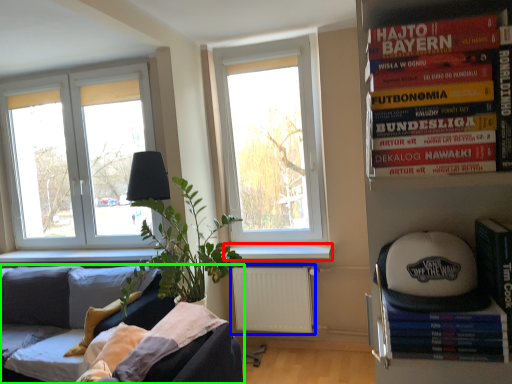
Question: Which object is the farthest from window sill (highlighted by a red box)? Choose among these: radiator (highlighted by a blue box) or studio couch (highlighted by a green box).

Choices:
 (A) radiator
 (B) studio couch

Answer: (B)